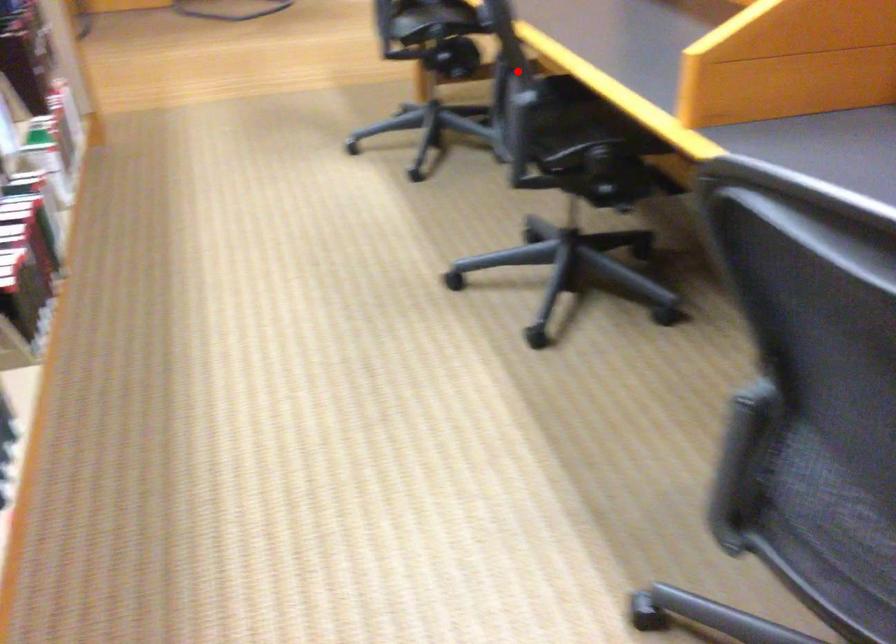
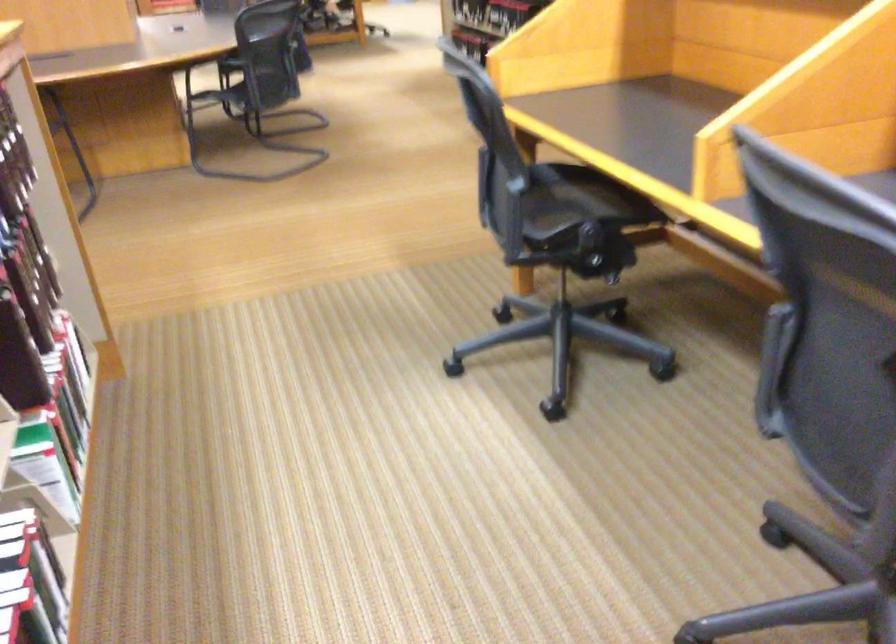
In the second image, find the point that corresponds to the highlighted location in the first image.

(830, 341)